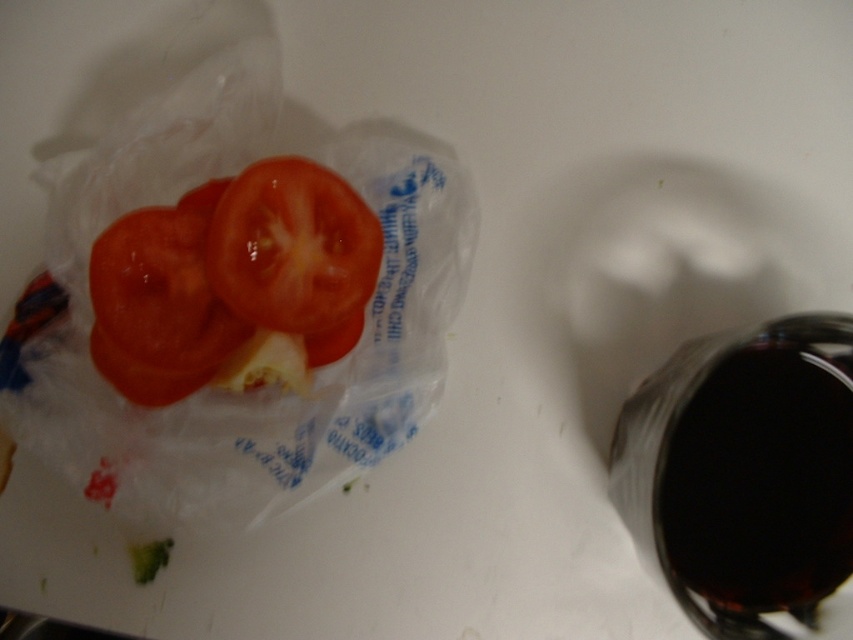
Does shiny red tomato at left appear under shiny red tomato at center?

Indeed, shiny red tomato at left is positioned under shiny red tomato at center.

Who is positioned more to the right, shiny red tomato at left or shiny red tomato at center?

Positioned to the right is shiny red tomato at center.

The height and width of the screenshot is (640, 853). Find the location of `shiny red tomato at left`. shiny red tomato at left is located at coordinates (231, 278).

Locate an element on the screen. This screenshot has width=853, height=640. shiny red tomato at left is located at coordinates (231, 278).